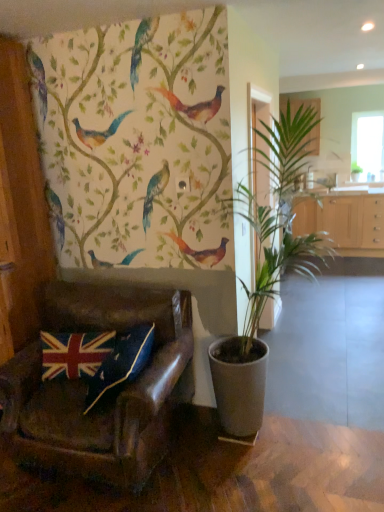
Based on the photo, measure the distance between green leafy plant at center, the 1th houseplant viewed from the right, and camera.

The depth of green leafy plant at center, the 1th houseplant viewed from the right, is 5.34 meters.

Measure the distance between point (294, 106) and camera.

Point (294, 106) and camera are 4.80 meters apart from each other.

The width and height of the screenshot is (384, 512). Identify the location of blue velvet pillow at lower left, the 1th pillow when ordered from right to left. (121, 362).

Locate an element on the screen. This screenshot has width=384, height=512. velvet union jack pillow at lower left, marked as the 1th pillow in a left-to-right arrangement is located at coordinates (74, 353).

This screenshot has width=384, height=512. I want to click on light wood cabinet at center, which appears as the second cabinetry when viewed from the top, so click(344, 222).

Is leather at left turned away from green leafy plant at center, arranged as the second houseplant when viewed from the top?

No.

Would you say leather at left is to the left or to the right of green leafy plant at center, arranged as the second houseplant when viewed from the back, in the picture?

leather at left is positioned on green leafy plant at center, arranged as the second houseplant when viewed from the back,'s left side.

Which of these two, leather at left or green leafy plant at center, the first houseplant viewed from the left, stands taller?

green leafy plant at center, the first houseplant viewed from the left, is taller.

From their relative heights in the image, would you say green leafy plant at center, the 1th houseplant viewed from the right, is taller or shorter than light wood cabinet at center, which appears as the second cabinetry when viewed from the top?

Considering their sizes, green leafy plant at center, the 1th houseplant viewed from the right, has less height than light wood cabinet at center, which appears as the second cabinetry when viewed from the top.

Based on their positions, is green leafy plant at center, acting as the 1th houseplant starting from the top, located to the left or right of light wood cabinet at center, the 1th cabinetry when ordered from bottom to top?

From the image, it's evident that green leafy plant at center, acting as the 1th houseplant starting from the top, is to the right of light wood cabinet at center, the 1th cabinetry when ordered from bottom to top.

Is point (356, 170) closer or farther from the camera than point (331, 226)?

Point (356, 170) appears to be closer to the viewer than point (331, 226).

Is blue velvet pillow at lower left, acting as the second pillow starting from the left, not close to leather at left?

blue velvet pillow at lower left, acting as the second pillow starting from the left, is actually quite close to leather at left.

Considering the sizes of objects blue velvet pillow at lower left, acting as the second pillow starting from the left, and leather at left in the image provided, who is thinner, blue velvet pillow at lower left, acting as the second pillow starting from the left, or leather at left?

Thinner between the two is blue velvet pillow at lower left, acting as the second pillow starting from the left.

Measure the distance from blue velvet pillow at lower left, acting as the second pillow starting from the left, to leather at left.

blue velvet pillow at lower left, acting as the second pillow starting from the left, and leather at left are 7.83 inches apart.

Based on the photo, from a real-world perspective, relative to leather at left, is blue velvet pillow at lower left, acting as the second pillow starting from the left, vertically above or below?

In terms of real-world spatial position, blue velvet pillow at lower left, acting as the second pillow starting from the left, is above leather at left.

Considering the relative sizes of velvet union jack pillow at lower left, which is the second pillow in right-to-left order, and green leafy plant at center, placed as the 1th houseplant when sorted from bottom to top, in the image provided, is velvet union jack pillow at lower left, which is the second pillow in right-to-left order, bigger than green leafy plant at center, placed as the 1th houseplant when sorted from bottom to top,?

Actually, velvet union jack pillow at lower left, which is the second pillow in right-to-left order, might be smaller than green leafy plant at center, placed as the 1th houseplant when sorted from bottom to top.

From the picture: Is velvet union jack pillow at lower left, which is the second pillow in right-to-left order, positioned in front of green leafy plant at center, the 1th houseplant positioned from the front?

No, the depth of velvet union jack pillow at lower left, which is the second pillow in right-to-left order, is greater than that of green leafy plant at center, the 1th houseplant positioned from the front.

Considering the sizes of objects velvet union jack pillow at lower left, which is the second pillow in right-to-left order, and green leafy plant at center, arranged as the second houseplant when viewed from the back, in the image provided, who is shorter, velvet union jack pillow at lower left, which is the second pillow in right-to-left order, or green leafy plant at center, arranged as the second houseplant when viewed from the back,?

velvet union jack pillow at lower left, which is the second pillow in right-to-left order, is shorter.

From a real-world perspective, does velvet union jack pillow at lower left, marked as the 1th pillow in a left-to-right arrangement, sit lower than green leafy plant at center, the 1th houseplant positioned from the front?

Yes, from a real-world perspective, velvet union jack pillow at lower left, marked as the 1th pillow in a left-to-right arrangement, is beneath green leafy plant at center, the 1th houseplant positioned from the front.

Is wooden cabinet at upper right, the second cabinetry from the bottom, beside green leafy plant at center, the 1th houseplant positioned from the front?

No, wooden cabinet at upper right, the second cabinetry from the bottom, is not next to green leafy plant at center, the 1th houseplant positioned from the front.

Does wooden cabinet at upper right, the second cabinetry from the bottom, lie in front of green leafy plant at center, the first houseplant viewed from the left?

That is False.

At what (x,y) coordinates should I click in order to perform the action: click on cabinetry that is the 2nd object located above the green leafy plant at center, arranged as the second houseplant when viewed from the top (from the image's perspective). Please return your answer as a coordinate pair (x, y). This screenshot has width=384, height=512. Looking at the image, I should click on (299, 105).

Consider the image. Can you confirm if transparent glass window at upper right is positioned to the left of velvet union jack pillow at lower left, marked as the 1th pillow in a left-to-right arrangement?

Incorrect, transparent glass window at upper right is not on the left side of velvet union jack pillow at lower left, marked as the 1th pillow in a left-to-right arrangement.

From the image's perspective, is transparent glass window at upper right located above or below velvet union jack pillow at lower left, marked as the 1th pillow in a left-to-right arrangement?

transparent glass window at upper right is situated higher than velvet union jack pillow at lower left, marked as the 1th pillow in a left-to-right arrangement, in the image.

From a real-world perspective, between transparent glass window at upper right and velvet union jack pillow at lower left, marked as the 1th pillow in a left-to-right arrangement, who is vertically lower?

velvet union jack pillow at lower left, marked as the 1th pillow in a left-to-right arrangement.

Which of these two, transparent glass window at upper right or velvet union jack pillow at lower left, which is the second pillow in right-to-left order, is smaller?

velvet union jack pillow at lower left, which is the second pillow in right-to-left order.

In terms of size, does light wood cabinet at center, which appears as the second cabinetry when viewed from the top, appear bigger or smaller than green leafy plant at center, which is the 2th houseplant in bottom-to-top order?

light wood cabinet at center, which appears as the second cabinetry when viewed from the top, is bigger than green leafy plant at center, which is the 2th houseplant in bottom-to-top order.

Would you consider light wood cabinet at center, which appears as the second cabinetry when viewed from the top, to be distant from green leafy plant at center, which is the second houseplant from front to back?

No, light wood cabinet at center, which appears as the second cabinetry when viewed from the top, is in close proximity to green leafy plant at center, which is the second houseplant from front to back.

Measure the distance from light wood cabinet at center, the 1th cabinetry when ordered from bottom to top, to green leafy plant at center, acting as the 1th houseplant starting from the top.

light wood cabinet at center, the 1th cabinetry when ordered from bottom to top, is 25.49 inches away from green leafy plant at center, acting as the 1th houseplant starting from the top.

Does light wood cabinet at center, the 1th cabinetry when ordered from bottom to top, have a lesser width compared to green leafy plant at center, which is the 2th houseplant in bottom-to-top order?

Incorrect, the width of light wood cabinet at center, the 1th cabinetry when ordered from bottom to top, is not less than that of green leafy plant at center, which is the 2th houseplant in bottom-to-top order.

Image resolution: width=384 pixels, height=512 pixels. I want to click on the 1st houseplant above the leather at left (from a real-world perspective), so click(265, 275).

Find the location of a particular element. cabinetry below the green leafy plant at center, the 1th houseplant viewed from the right (from a real-world perspective) is located at coordinates (344, 222).

Considering their positions, is green leafy plant at center, which ranks as the second houseplant in left-to-right order, positioned closer to blue velvet pillow at lower left, acting as the second pillow starting from the left, than wooden cabinet at upper right, the second cabinetry from the bottom?

Based on the image, wooden cabinet at upper right, the second cabinetry from the bottom, appears to be nearer to blue velvet pillow at lower left, acting as the second pillow starting from the left.

Which object lies further to the anchor point green leafy plant at center, which is the second houseplant from front to back, velvet union jack pillow at lower left, which is the second pillow in right-to-left order, or blue velvet pillow at lower left, the 1th pillow when ordered from right to left?

velvet union jack pillow at lower left, which is the second pillow in right-to-left order, lies further to green leafy plant at center, which is the second houseplant from front to back, than the other object.

When comparing their distances from velvet union jack pillow at lower left, marked as the 1th pillow in a left-to-right arrangement, does green leafy plant at center, arranged as the second houseplant when viewed from the back, or transparent glass window at upper right seem further?

transparent glass window at upper right is positioned further to the anchor velvet union jack pillow at lower left, marked as the 1th pillow in a left-to-right arrangement.

Considering their positions, is transparent glass window at upper right positioned closer to green leafy plant at center, which is the second houseplant from front to back, than green leafy plant at center, placed as the 1th houseplant when sorted from bottom to top?

transparent glass window at upper right.

Which object lies nearer to the anchor point green leafy plant at center, arranged as the second houseplant when viewed from the back, leather at left or light wood cabinet at center, the 1th cabinetry when ordered from bottom to top?

Among the two, leather at left is located nearer to green leafy plant at center, arranged as the second houseplant when viewed from the back.

Which object lies further to the anchor point green leafy plant at center, placed as the second houseplant when sorted from right to left, transparent glass window at upper right or green leafy plant at center, acting as the 1th houseplant starting from the back?

The object further to green leafy plant at center, placed as the second houseplant when sorted from right to left, is green leafy plant at center, acting as the 1th houseplant starting from the back.

When comparing their distances from blue velvet pillow at lower left, the 1th pillow when ordered from right to left, does green leafy plant at center, which is the second houseplant from front to back, or velvet union jack pillow at lower left, which is the second pillow in right-to-left order, seem closer?

velvet union jack pillow at lower left, which is the second pillow in right-to-left order, is positioned closer to the anchor blue velvet pillow at lower left, the 1th pillow when ordered from right to left.

Considering their positions, is transparent glass window at upper right positioned further to light wood cabinet at center, which appears as the second cabinetry when viewed from the top, than blue velvet pillow at lower left, the 1th pillow when ordered from right to left?

Among the two, blue velvet pillow at lower left, the 1th pillow when ordered from right to left, is located further to light wood cabinet at center, which appears as the second cabinetry when viewed from the top.

Find the location of a particular element. This screenshot has height=512, width=384. pillow between blue velvet pillow at lower left, acting as the second pillow starting from the left, and wooden cabinet at upper right, which is the 1th cabinetry in top-to-bottom order, from front to back is located at coordinates (74, 353).

Locate an element on the screen. This screenshot has width=384, height=512. pillow between blue velvet pillow at lower left, acting as the second pillow starting from the left, and green leafy plant at center, acting as the 1th houseplant starting from the top, in the front-back direction is located at coordinates (74, 353).

Where is `cabinetry located between velvet union jack pillow at lower left, marked as the 1th pillow in a left-to-right arrangement, and wooden cabinet at upper right, which is the 1th cabinetry in top-to-bottom order, in the depth direction`? cabinetry located between velvet union jack pillow at lower left, marked as the 1th pillow in a left-to-right arrangement, and wooden cabinet at upper right, which is the 1th cabinetry in top-to-bottom order, in the depth direction is located at coordinates (344, 222).

This screenshot has width=384, height=512. Identify the location of pillow positioned between leather at left and velvet union jack pillow at lower left, marked as the 1th pillow in a left-to-right arrangement, from near to far. (121, 362).